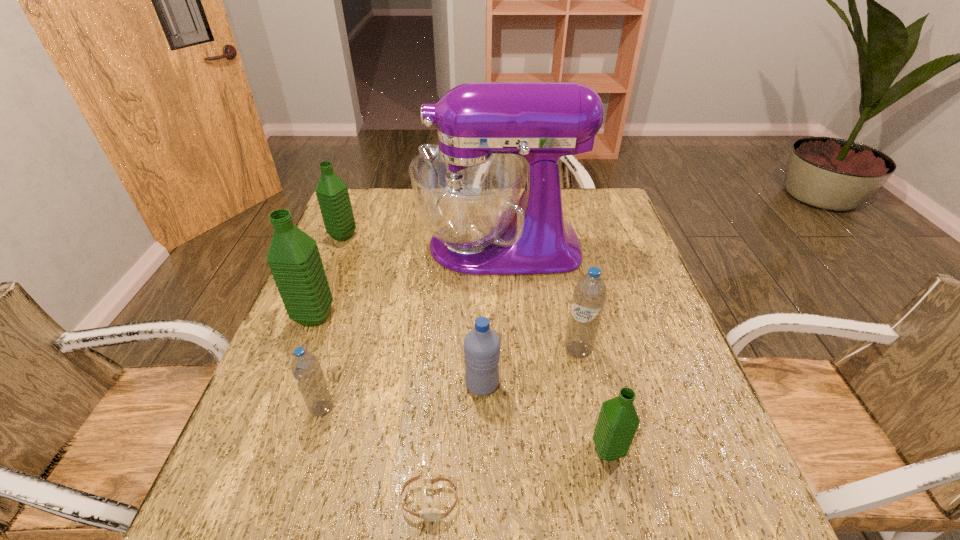
You are a GUI agent. You are given a task and a screenshot of the screen. Output one action in this format:
    pyautogui.click(x=<x>, y=<y>)
    Task: Click on the empty location between the leftmost blue water bottle and the seventh farthest object
    
    Given the screenshot: What is the action you would take?
    pyautogui.click(x=465, y=429)

The height and width of the screenshot is (540, 960). Identify the location of vacant area that lies between the third object from left to right and the nearest water bottle. (465, 429).

Find the location of a particular element. The height and width of the screenshot is (540, 960). vacant point located between the fifth nearest water bottle and the farthest water bottle is located at coordinates (328, 276).

This screenshot has height=540, width=960. Identify the location of free point between the third farthest water bottle and the farthest water bottle. (460, 293).

The width and height of the screenshot is (960, 540). In order to click on blank region between the mixer and the second blue water bottle from left to right in this screenshot , I will do `click(491, 315)`.

You are a GUI agent. You are given a task and a screenshot of the screen. Output one action in this format:
    pyautogui.click(x=<x>, y=<y>)
    Task: Click on the vacant region between the third water bottle from right to left and the fifth nearest water bottle
    
    Given the screenshot: What is the action you would take?
    pyautogui.click(x=398, y=350)

Find the location of `blank region between the tallest object and the second blue water bottle from right to left`. blank region between the tallest object and the second blue water bottle from right to left is located at coordinates (491, 315).

Locate an element on the screen. This screenshot has width=960, height=540. unoccupied position between the purple mixer and the farthest green water bottle is located at coordinates (420, 241).

In order to click on vacant area between the biggest green water bottle and the tallest object in this screenshot , I will do `click(406, 281)`.

Identify the location of free space that is in between the sixth object from right to left and the fifth nearest object. Image resolution: width=960 pixels, height=540 pixels. (450, 379).